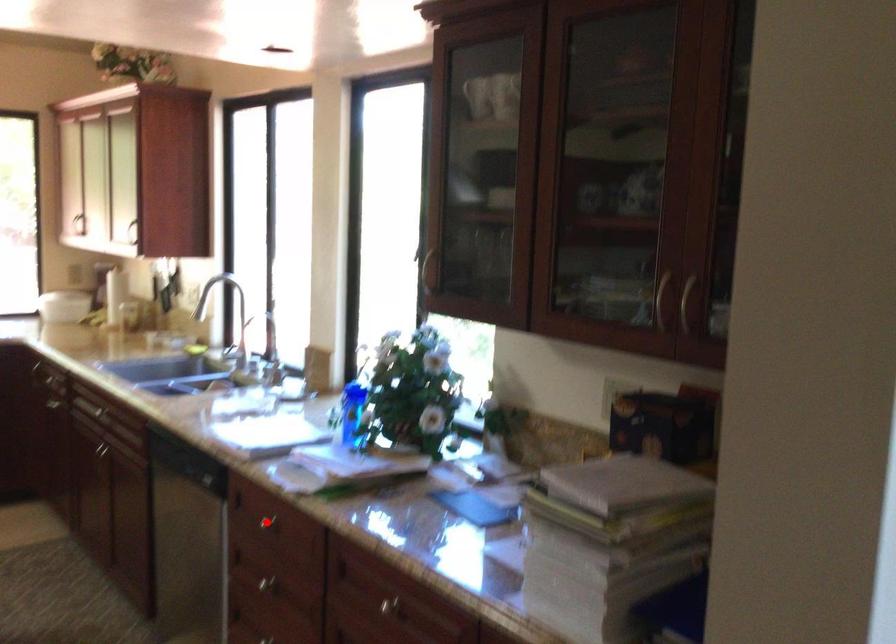
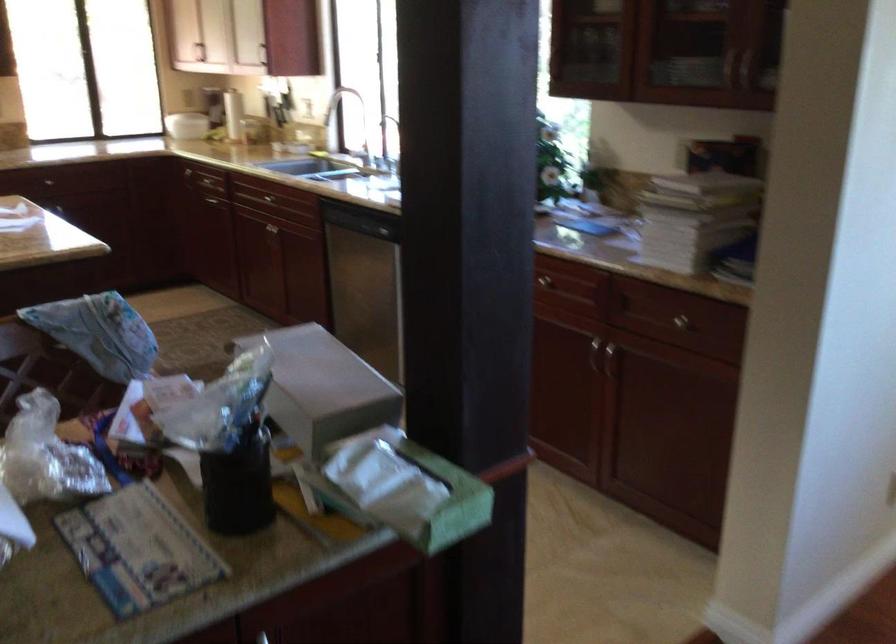
Question: I am providing you with two images of the same scene from different viewpoints. A red point is marked on the first image. Can you still see the location of the red point in image 2?

Choices:
 (A) Yes
 (B) No

Answer: (B)